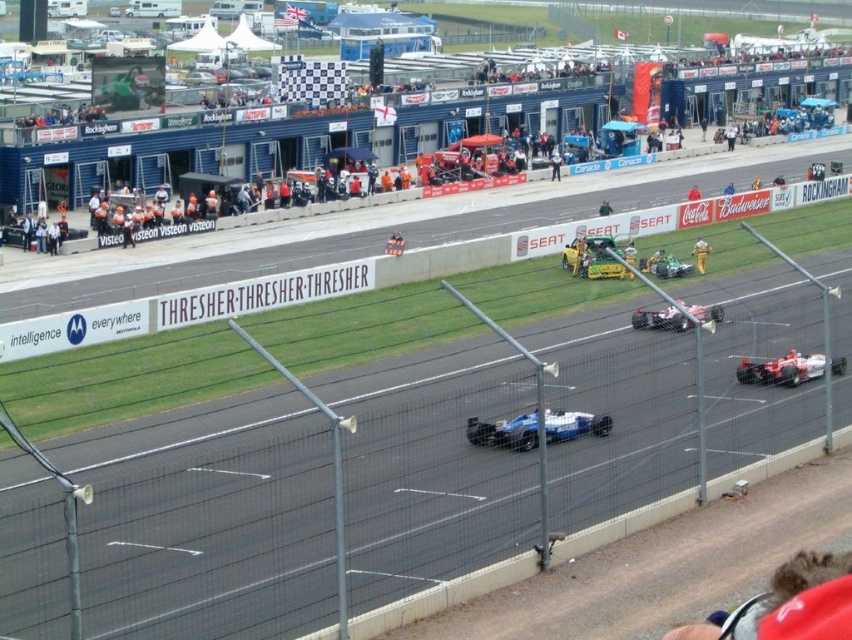
Based on the photo, between orange reflective vest at center and green matte race car at center, which one is positioned lower?

Positioned lower is green matte race car at center.

Based on the photo, does orange reflective vest at center appear on the right side of green matte race car at center?

Yes, orange reflective vest at center is to the right of green matte race car at center.

Does point (743, 145) come behind point (661, 269)?

Yes.

Locate an element on the screen. Image resolution: width=852 pixels, height=640 pixels. orange reflective vest at center is located at coordinates (372, 205).

Between point (209, 538) and point (599, 214), which one is positioned in front?

Point (209, 538)

Is black asphalt race track at center taller than dark blue suit at center?

Correct, black asphalt race track at center is much taller as dark blue suit at center.

Is point (301, 541) positioned behind point (602, 204)?

That is False.

You are a GUI agent. You are given a task and a screenshot of the screen. Output one action in this format:
    pyautogui.click(x=<x>, y=<y>)
    Task: Click on the black asphalt race track at center
    The width and height of the screenshot is (852, 640).
    Given the screenshot: What is the action you would take?
    pyautogui.click(x=306, y=513)

Can you confirm if brown gravel dirt track at center is positioned to the right of red fabric cap at lower right?

No, brown gravel dirt track at center is not to the right of red fabric cap at lower right.

Can you confirm if brown gravel dirt track at center is wider than red fabric cap at lower right?

Indeed, brown gravel dirt track at center has a greater width compared to red fabric cap at lower right.

Where is `brown gravel dirt track at center`? The image size is (852, 640). brown gravel dirt track at center is located at coordinates (665, 566).

The width and height of the screenshot is (852, 640). I want to click on brown gravel dirt track at center, so click(x=665, y=566).